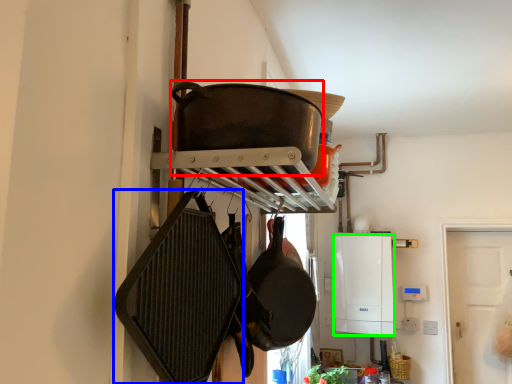
Question: Which object is the farthest from wok (highlighted by a red box)? Choose among these: frying pan (highlighted by a blue box) or appliance (highlighted by a green box).

Choices:
 (A) frying pan
 (B) appliance

Answer: (B)